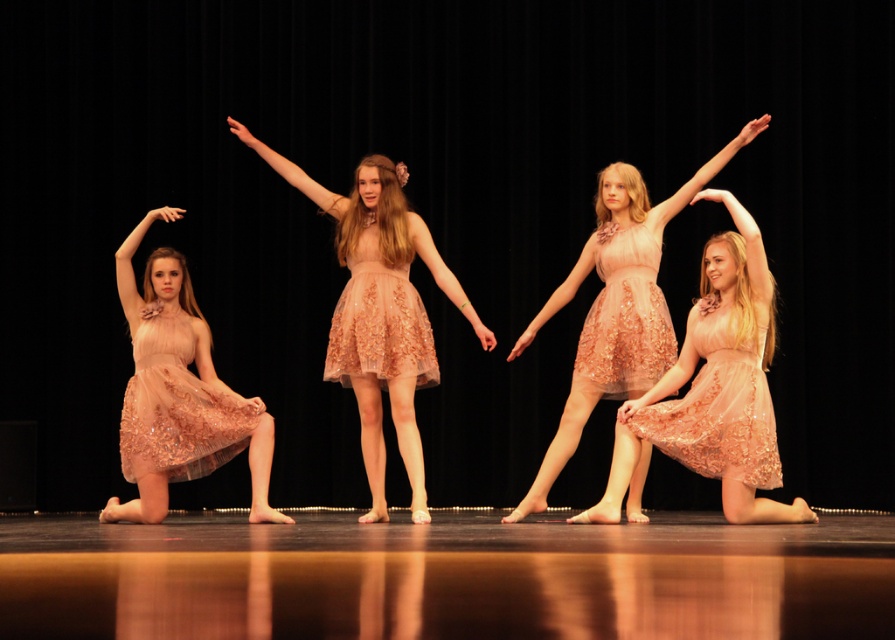
You are a stage designer preparing to place two dresses on a mannequin. You have the matte pink dress at center and the lace peach dress at center. Which dress should you choose if you want the one that is bigger in size?

The matte pink dress at center is larger in size than the lace peach dress at center, so you should choose the matte pink dress at center.

You are a photographer taking a picture of the stage. You notice two points marked on the stage at coordinates point (765,464) and point (169,467). Which point is closer to your camera?

Point (765,464) is closer to the camera than point (169,467).